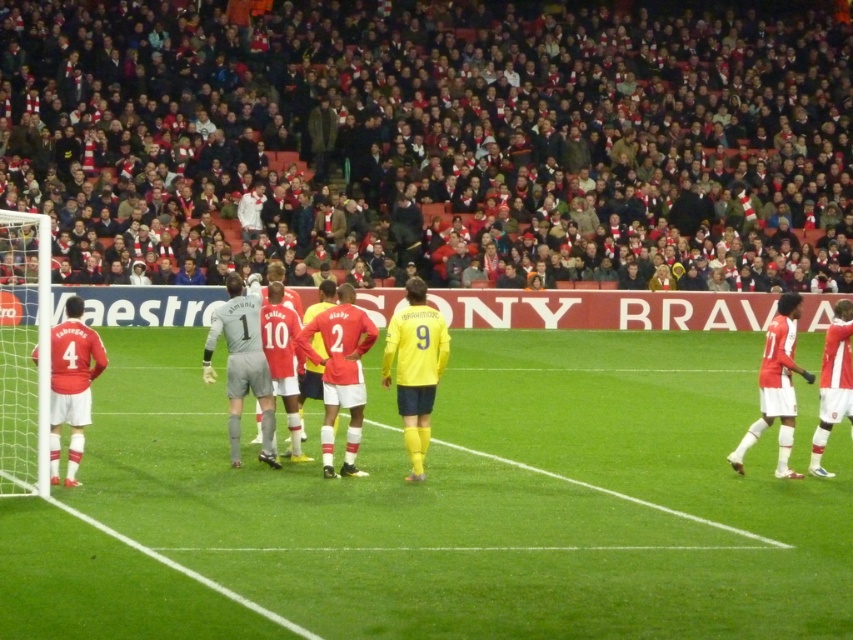
Looking at this image, you are a photographer standing at the camera position. You want to take a photo of the point marked at coordinates point [672,570]. Will the point be in focus if your camera has a depth of field that can only cover objects within 25 feet from the camera?

The point [672,570] is 29.95 feet from the camera, which is beyond the 25 feet depth of field range. Therefore, the point will not be in focus.

You are a soccer referee standing at the center circle of the field. You need to check the distance between the white plastic goal at left and your current position. Can you confirm if it is within the standard FIFA regulation distance for a goal kick?

The white plastic goal at left is 10.82 meters from the viewer. According to FIFA regulations, the distance between the goal area and the center circle is more than 10.82 meters, so the goal kick should be taken from within the goal area, which is closer to the goal than the center circle. Therefore, the distance from the center circle to the goal is beyond the required range for a goal kick.

You are a photographer standing at the edge of the soccer field. You want to take a closeup shot of the red scarf at upper center. Given that your camera can focus on objects up to 30 meters away, will you be able to capture it clearly?

The red scarf at upper center is 27.92 meters from viewer, so yes, the camera can focus on it since it is within the 30 meters range.